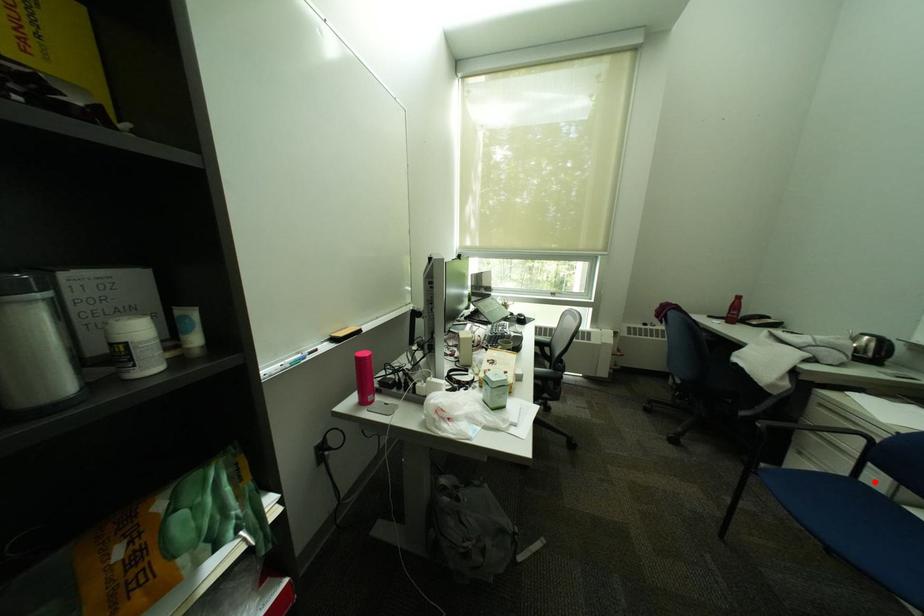
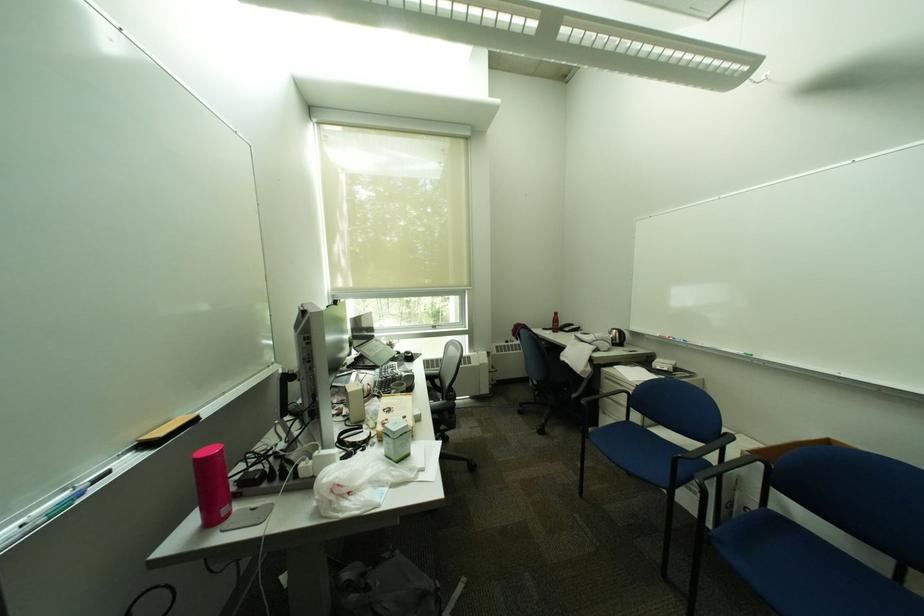
Question: I am providing you with two images of the same scene from different viewpoints. In image1, a red point is highlighted. Considering the same 3D point in image2, which of the following is correct?

Choices:
 (A) It is closer
 (B) It is farther

Answer: (A)